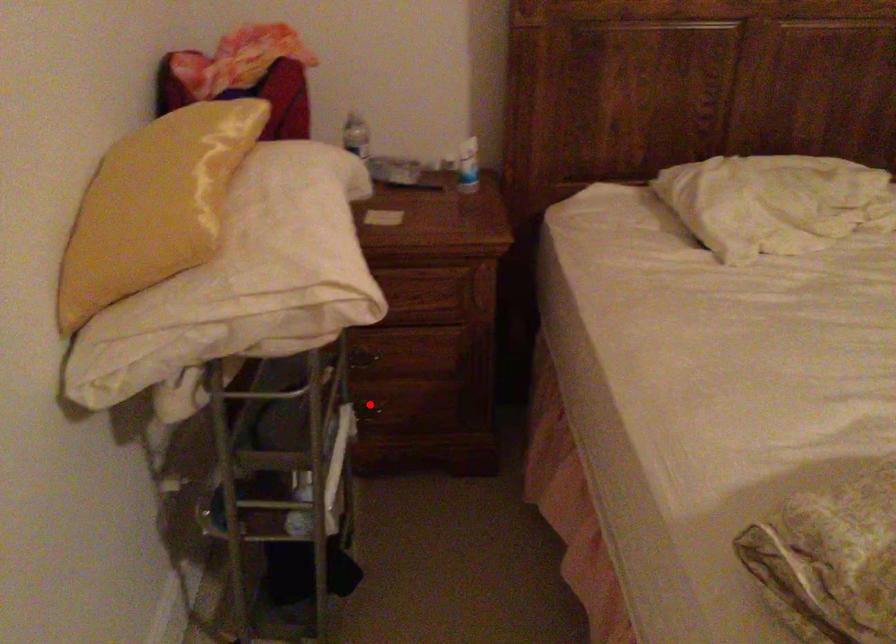
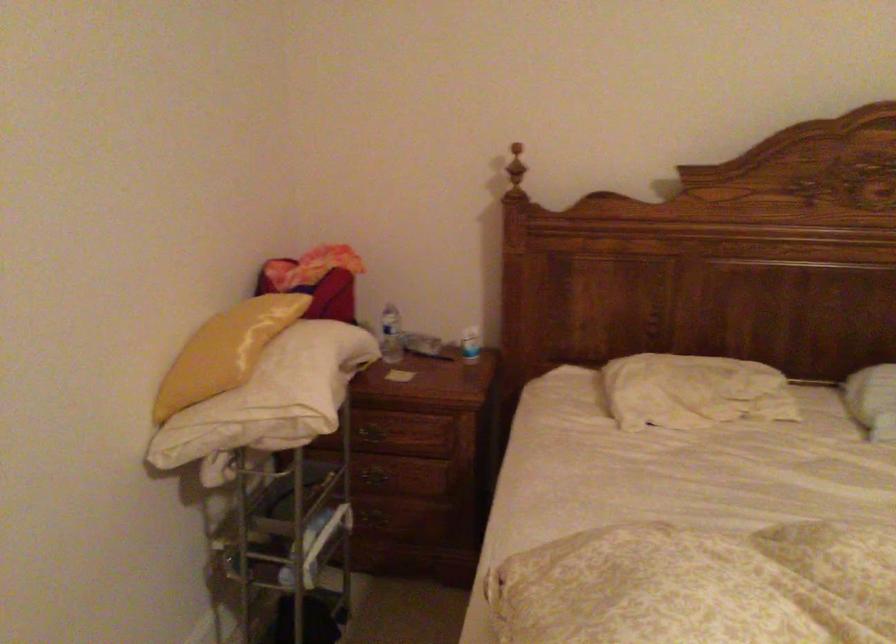
Question: I am providing you with two images of the same scene from different viewpoints. Given a red point in image1, look at the same physical point in image2. Is it:

Choices:
 (A) Closer to the viewpoint
 (B) Farther from the viewpoint

Answer: (B)